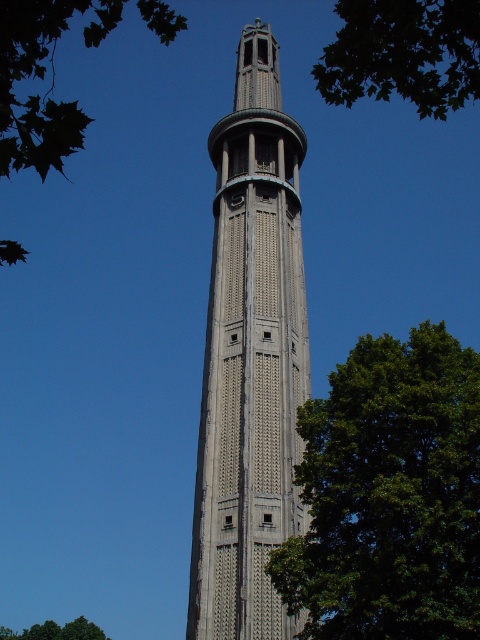
Question: Does green leafy tree at center have a lesser width compared to green leafy tree at lower left?

Choices:
 (A) no
 (B) yes

Answer: (B)

Question: Is green leafy tree at center wider than green leafy tree at upper left?

Choices:
 (A) yes
 (B) no

Answer: (B)

Question: Which point is closer to the camera?

Choices:
 (A) green leafy tree at upper left
 (B) gray stone tower at center
 (C) green leafy tree at lower left
 (D) green leafy tree at center

Answer: (A)

Question: Is green leafy tree at upper right below green leafy tree at upper left?

Choices:
 (A) no
 (B) yes

Answer: (A)

Question: Which object is the closest to the gray stone tower at center?

Choices:
 (A) green leafy tree at upper left
 (B) green leafy tree at lower left
 (C) green leafy tree at center

Answer: (C)

Question: Estimate the real-world distances between objects in this image. Which object is farther from the gray stone tower at center?

Choices:
 (A) green leafy tree at center
 (B) green leafy tree at upper left

Answer: (B)